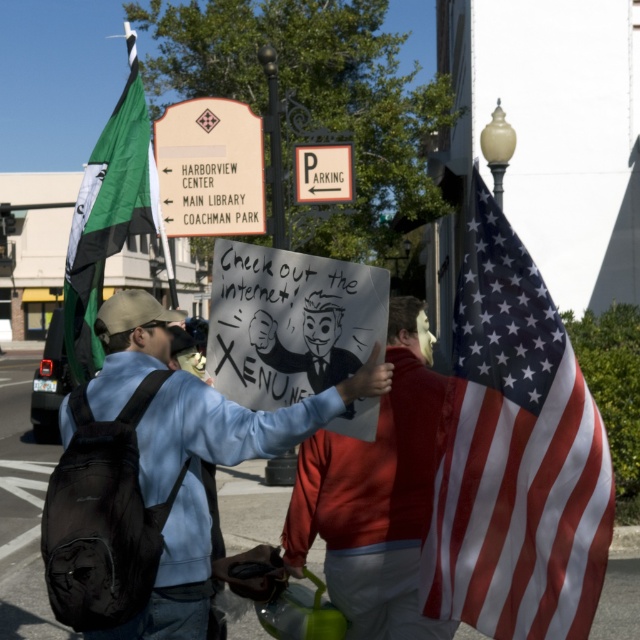
Question: Does red cotton hoodie at center appear on the right side of green fabric flag at left?

Choices:
 (A) no
 (B) yes

Answer: (B)

Question: Does green fabric flag at left appear on the right side of white plastic sign at upper center?

Choices:
 (A) no
 (B) yes

Answer: (A)

Question: Does red-white-striped flag at right have a greater width compared to white plastic sign at upper center?

Choices:
 (A) no
 (B) yes

Answer: (A)

Question: Considering the real-world distances, which object is farthest from the red cotton hoodie at center?

Choices:
 (A) matte blue sweatshirt at center
 (B) white plastic sign at upper center
 (C) green fabric flag at left
 (D) red-white-striped flag at right

Answer: (B)

Question: Among these objects, which one is nearest to the camera?

Choices:
 (A) green fabric flag at left
 (B) red-white-striped flag at right

Answer: (B)

Question: Among these points, which one is nearest to the camera?

Choices:
 (A) (154, 134)
 (B) (474, 580)
 (C) (77, 355)
 (D) (113, 413)

Answer: (B)